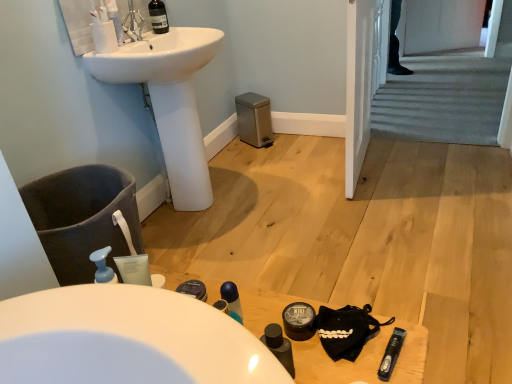
You are a GUI agent. You are given a task and a screenshot of the screen. Output one action in this format:
    pyautogui.click(x=<x>, y=<y>)
    Task: Click on the blue plastic mouthwash at center, acting as the second mouthwash starting from the left
    
    Given the screenshot: What is the action you would take?
    pyautogui.click(x=232, y=300)

What is the approximate height of transparent glass wine bottle at upper center?

transparent glass wine bottle at upper center is 7.14 inches in height.

Measure the distance between point (439, 128) and camera.

The distance of point (439, 128) from camera is 8.69 feet.

In order to face transparent plastic mouthwash at lower right, which ranks as the 3th mouthwash in left-to-right order, should I rotate leftwards or rightwards?

You should rotate right by 17.613 degrees.

Image resolution: width=512 pixels, height=384 pixels. Describe the element at coordinates (391, 354) in the screenshot. I see `transparent plastic mouthwash at lower right, acting as the first mouthwash starting from the bottom` at that location.

Describe the element at coordinates (170, 101) in the screenshot. I see `white glossy sink at upper left` at that location.

Describe the element at coordinates (362, 359) in the screenshot. I see `black matte table at lower center` at that location.

The height and width of the screenshot is (384, 512). Describe the element at coordinates (115, 20) in the screenshot. I see `translucent plastic mouthwash at upper left, acting as the 3th mouthwash starting from the front` at that location.

I want to click on translucent plastic mouthwash at upper left, placed as the 1th mouthwash when sorted from top to bottom, so click(115, 20).

Locate an element on the screen. The image size is (512, 384). blue plastic mouthwash at center, marked as the 2th mouthwash in a top-to-bottom arrangement is located at coordinates (232, 300).

Between white glossy sink at upper left and carpeted stairs at center, which one has smaller size?

With smaller size is white glossy sink at upper left.

From the image's perspective, which object appears higher, white glossy sink at upper left or carpeted stairs at center?

From the image's view, carpeted stairs at center is above.

Can you confirm if white glossy sink at upper left is shorter than carpeted stairs at center?

In fact, white glossy sink at upper left may be taller than carpeted stairs at center.

Consider the image. Does white glossy sink at upper left turn towards carpeted stairs at center?

No, white glossy sink at upper left is not facing towards carpeted stairs at center.

Is black fabric mask at lower center looking in the opposite direction of translucent plastic mouthwash at upper left, which appears as the 1th mouthwash when viewed from the back?

black fabric mask at lower center is not turned away from translucent plastic mouthwash at upper left, which appears as the 1th mouthwash when viewed from the back.

Between black fabric mask at lower center and translucent plastic mouthwash at upper left, which appears as the 1th mouthwash when viewed from the back, which one has smaller size?

Smaller between the two is translucent plastic mouthwash at upper left, which appears as the 1th mouthwash when viewed from the back.

How far apart are black fabric mask at lower center and translucent plastic mouthwash at upper left, placed as the 1th mouthwash when sorted from top to bottom?

black fabric mask at lower center and translucent plastic mouthwash at upper left, placed as the 1th mouthwash when sorted from top to bottom, are 1.41 meters apart from each other.

Is point (338, 358) farther from camera compared to point (441, 135)?

That is False.

Which of these two, black fabric mask at lower center or carpeted stairs at center, is thinner?

Thinner between the two is black fabric mask at lower center.

Is black fabric mask at lower center shorter than carpeted stairs at center?

No.

You are a GUI agent. You are given a task and a screenshot of the screen. Output one action in this format:
    pyautogui.click(x=<x>, y=<y>)
    Task: Click on the stairs below the black fabric mask at lower center (from a real-world perspective)
    The height and width of the screenshot is (384, 512).
    Given the screenshot: What is the action you would take?
    pyautogui.click(x=443, y=98)

From the image's perspective, which one is positioned higher, transparent plastic mouthwash at lower right, marked as the first mouthwash in a front-to-back arrangement, or transparent glass wine bottle at upper center?

transparent glass wine bottle at upper center appears higher in the image.

Considering the relative sizes of transparent plastic mouthwash at lower right, which ranks as the 3th mouthwash in left-to-right order, and transparent glass wine bottle at upper center in the image provided, is transparent plastic mouthwash at lower right, which ranks as the 3th mouthwash in left-to-right order, thinner than transparent glass wine bottle at upper center?

In fact, transparent plastic mouthwash at lower right, which ranks as the 3th mouthwash in left-to-right order, might be wider than transparent glass wine bottle at upper center.

Which of these two, transparent plastic mouthwash at lower right, the 1th mouthwash from the right, or transparent glass wine bottle at upper center, is bigger?

transparent glass wine bottle at upper center is bigger.

Is transparent plastic mouthwash at lower right, placed as the third mouthwash when sorted from back to front, located outside transparent glass wine bottle at upper center?

Absolutely, transparent plastic mouthwash at lower right, placed as the third mouthwash when sorted from back to front, is external to transparent glass wine bottle at upper center.

From the picture: Is black matte table at lower center oriented away from transparent glass wine bottle at upper center?

No, black matte table at lower center's orientation is not away from transparent glass wine bottle at upper center.

Is black matte table at lower center thinner than transparent glass wine bottle at upper center?

Incorrect, the width of black matte table at lower center is not less than that of transparent glass wine bottle at upper center.

From a real-world perspective, is black matte table at lower center physically located above or below transparent glass wine bottle at upper center?

black matte table at lower center is below transparent glass wine bottle at upper center.

In the image, is black matte table at lower center on the left side or the right side of transparent glass wine bottle at upper center?

Clearly, black matte table at lower center is on the right of transparent glass wine bottle at upper center in the image.

Which of these two, white glossy sink at upper left or black matte table at lower center, is bigger?

Bigger between the two is white glossy sink at upper left.

Is white glossy sink at upper left oriented towards black matte table at lower center?

No.

Is the surface of white glossy sink at upper left in direct contact with black matte table at lower center?

white glossy sink at upper left is not next to black matte table at lower center, and they're not touching.

Which point is more forward, (162,108) or (277,319)?

Point (277,319)

Is carpeted stairs at center taller or shorter than translucent plastic mouthwash at upper left, which is the third mouthwash from bottom to top?

Considering their sizes, carpeted stairs at center has less height than translucent plastic mouthwash at upper left, which is the third mouthwash from bottom to top.

Is carpeted stairs at center further to camera compared to translucent plastic mouthwash at upper left, which appears as the 1th mouthwash when viewed from the back?

Yes, it is.

Considering the positions of objects carpeted stairs at center and translucent plastic mouthwash at upper left, which is the third mouthwash from bottom to top, in the image provided, who is more to the left, carpeted stairs at center or translucent plastic mouthwash at upper left, which is the third mouthwash from bottom to top,?

From the viewer's perspective, translucent plastic mouthwash at upper left, which is the third mouthwash from bottom to top, appears more on the left side.

Could you tell me if carpeted stairs at center is facing translucent plastic mouthwash at upper left, the third mouthwash in the right-to-left sequence?

No, carpeted stairs at center is not oriented towards translucent plastic mouthwash at upper left, the third mouthwash in the right-to-left sequence.

Identify the location of sink on the left of the carpeted stairs at center. coord(170,101).

I want to click on accessory beneath the translucent plastic mouthwash at upper left, placed as the 1th mouthwash when sorted from top to bottom (from a real-world perspective), so click(x=346, y=330).

Looking at the image, which one is located closer to black fabric mask at lower center, matte black container at lower center or white glossy sink at upper left?

matte black container at lower center lies closer to black fabric mask at lower center than the other object.

When comparing their distances from black fabric mask at lower center, does carpeted stairs at center or matte black container at lower center seem further?

carpeted stairs at center lies further to black fabric mask at lower center than the other object.

Considering their positions, is carpeted stairs at center positioned closer to blue plastic mouthwash at center, placed as the second mouthwash when sorted from bottom to top, than transparent plastic mouthwash at lower right, placed as the third mouthwash when sorted from back to front?

transparent plastic mouthwash at lower right, placed as the third mouthwash when sorted from back to front, is closer to blue plastic mouthwash at center, placed as the second mouthwash when sorted from bottom to top.

Looking at the image, which one is located further to translucent plastic mouthwash at upper left, which is counted as the first mouthwash, starting from the left, black fabric mask at lower center or black matte table at lower center?

black fabric mask at lower center is positioned further to the anchor translucent plastic mouthwash at upper left, which is counted as the first mouthwash, starting from the left.

When comparing their distances from black matte table at lower center, does blue plastic mouthwash at center, which appears as the second mouthwash when viewed from the back, or carpeted stairs at center seem further?

Based on the image, carpeted stairs at center appears to be further to black matte table at lower center.

When comparing their distances from transparent glass wine bottle at upper center, does white glossy sink at upper left or matte black container at lower center seem closer?

white glossy sink at upper left lies closer to transparent glass wine bottle at upper center than the other object.

From the picture: From the image, which object appears to be farther from translucent plastic mouthwash at upper left, which is the third mouthwash from bottom to top, transparent glass wine bottle at upper center or transparent plastic mouthwash at lower right, placed as the 3th mouthwash when sorted from top to bottom?

Based on the image, transparent plastic mouthwash at lower right, placed as the 3th mouthwash when sorted from top to bottom, appears to be further to translucent plastic mouthwash at upper left, which is the third mouthwash from bottom to top.

Which object lies further to the anchor point black matte table at lower center, white glossy sink at upper left or translucent plastic mouthwash at upper left, which is the third mouthwash from bottom to top?

translucent plastic mouthwash at upper left, which is the third mouthwash from bottom to top, is further to black matte table at lower center.

Locate an element on the screen. toiletry between black matte table at lower center and white glossy sink at upper left in the front-back direction is located at coordinates (298, 321).

The image size is (512, 384). I want to click on table between transparent glass wine bottle at upper center and carpeted stairs at center, so click(362, 359).

What are the coordinates of `mouthwash situated between black matte table at lower center and carpeted stairs at center from left to right` in the screenshot? It's located at click(391, 354).

Find the location of a particular element. This screenshot has height=384, width=512. toiletry between transparent glass wine bottle at upper center and carpeted stairs at center is located at coordinates (298, 321).